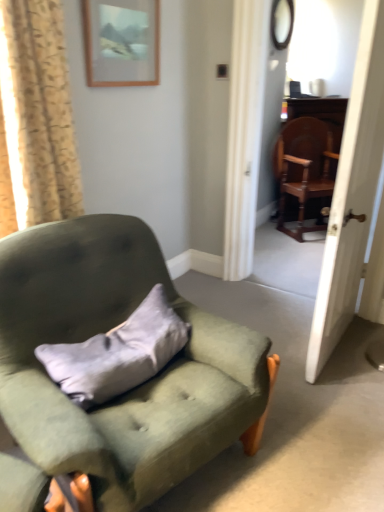
Question: Is beige floral fabric curtain at left inside or outside of matte wooden picture frame at upper center?

Choices:
 (A) inside
 (B) outside

Answer: (B)

Question: In terms of height, does beige floral fabric curtain at left look taller or shorter compared to matte wooden picture frame at upper center?

Choices:
 (A) short
 (B) tall

Answer: (B)

Question: Considering the real-world distances, which object is closest to the wooden polished chair at right, acting as the second chair starting from the bottom?

Choices:
 (A) gray suede pillow at center
 (B) velvet green armchair at left, arranged as the 2th chair when viewed from the top
 (C) wooden screen door at right
 (D) matte wooden picture frame at upper center
 (E) beige floral fabric curtain at left

Answer: (C)

Question: Which object is positioned farthest from the wooden screen door at right?

Choices:
 (A) gray suede pillow at center
 (B) matte wooden picture frame at upper center
 (C) wooden polished chair at right, acting as the 2th chair starting from the front
 (D) beige floral fabric curtain at left
 (E) velvet green armchair at left, which appears as the 1th chair when viewed from the front

Answer: (C)